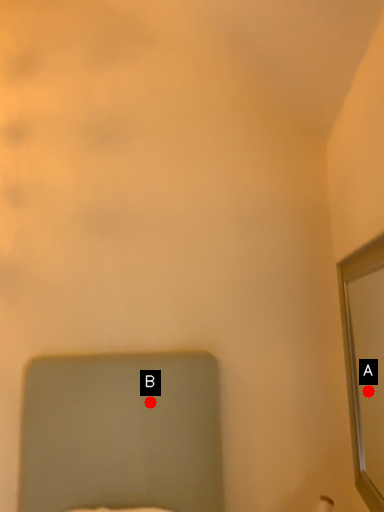
Question: Two points are circled on the image, labeled by A and B beside each circle. Which point is closer to the camera taking this photo?

Choices:
 (A) A is closer
 (B) B is closer

Answer: (A)